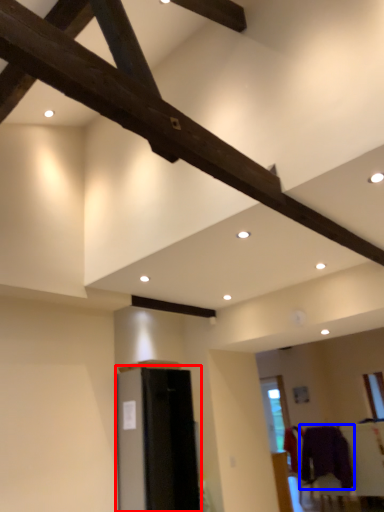
Question: Among these objects, which one is nearest to the camera, furniture (highlighted by a red box) or clothing (highlighted by a blue box)?

Choices:
 (A) furniture
 (B) clothing

Answer: (A)